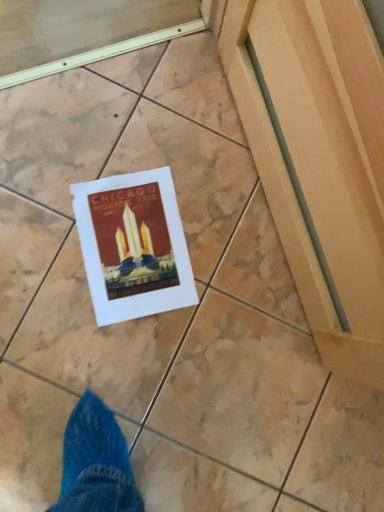
Where is `vacant space in front of matte paper postcard at center`? vacant space in front of matte paper postcard at center is located at coordinates (77, 339).